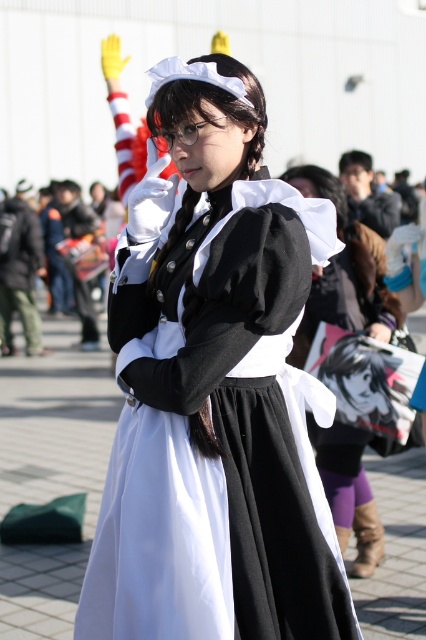
You are a photographer at the event and want to capture a clear photo of the matte black dress at center without the white satin dress at center blocking it. How can you adjust your position to achieve this?

The matte black dress at center is in front of the white satin dress at center. To capture the matte black dress at center without obstruction, move your camera position so that you are facing away from the white satin dress at center, ensuring the matte black dress at center remains in the foreground.

You are organizing a costume party and need to ensure that all outfits are displayed properly. You have two dresses at the center of the display area, the matte black dress at center and the white satin dress at center. Which dress requires more space due to its size?

The matte black dress at center requires more space because it is larger in size than the white satin dress at center.

You are a photographer at the event and want to capture both the matte black dress at center and the white satin dress at center in a single frame. Which dress should you position closer to the left side of the camera to ensure both are visible?

You should position the matte black dress at center closer to the left side of the camera since it is already to the left of the white satin dress at center in the original image.